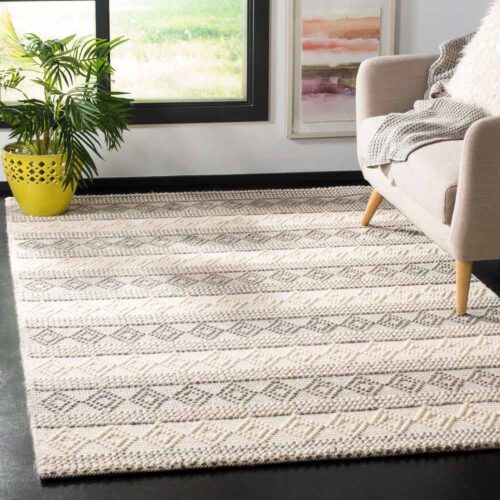
Identify the location of space under painting. The width and height of the screenshot is (500, 500). [x=330, y=153].